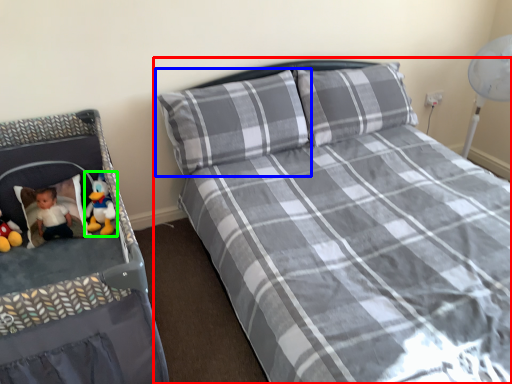
Question: Which object is the closest to the bed (highlighted by a red box)? Choose among these: pillow (highlighted by a blue box) or toy (highlighted by a green box).

Choices:
 (A) pillow
 (B) toy

Answer: (A)